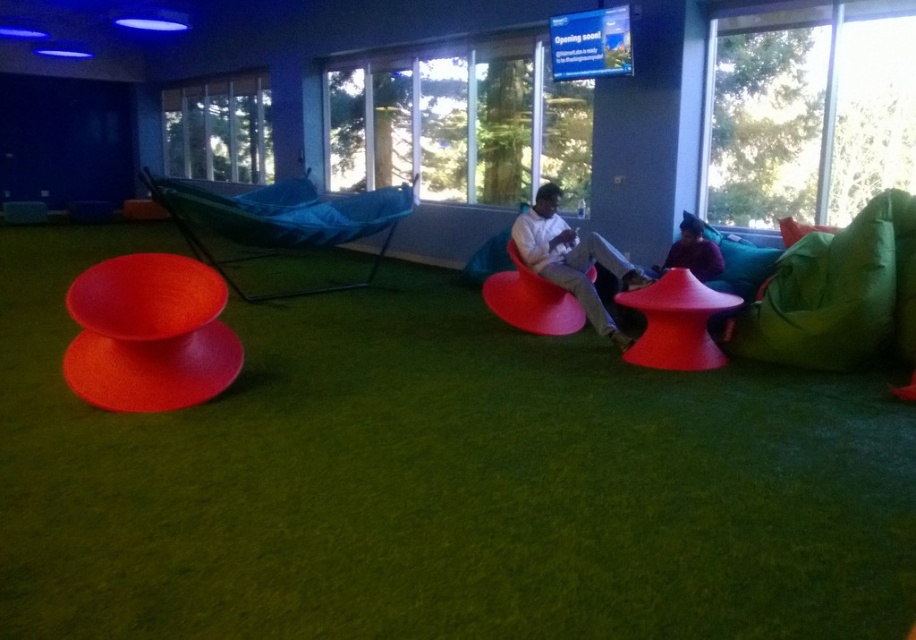
Which is behind, point (128, 387) or point (540, 298)?

The point (540, 298) is more distant.

Can you confirm if matte red stool at lower left is positioned to the right of matte red armchair at center?

No, matte red stool at lower left is not to the right of matte red armchair at center.

Between point (172, 337) and point (562, 317), which one is positioned in front?

Point (172, 337) is more forward.

The height and width of the screenshot is (640, 916). Identify the location of matte red stool at lower left. (149, 333).

Between blue fabric hammock at center and matte red stool at center, which one has less height?

With less height is matte red stool at center.

Can you confirm if blue fabric hammock at center is thinner than matte red stool at center?

No, blue fabric hammock at center is not thinner than matte red stool at center.

Does point (369, 269) come farther from viewer compared to point (664, 298)?

Yes, point (369, 269) is farther from viewer.

The image size is (916, 640). I want to click on blue fabric hammock at center, so click(281, 220).

Which is below, blue fabric hammock at center or matte white sweater at center?

matte white sweater at center is lower down.

Who is more forward, (230, 228) or (560, 230)?

Point (560, 230)

Image resolution: width=916 pixels, height=640 pixels. Find the location of `blue fabric hammock at center`. blue fabric hammock at center is located at coordinates (281, 220).